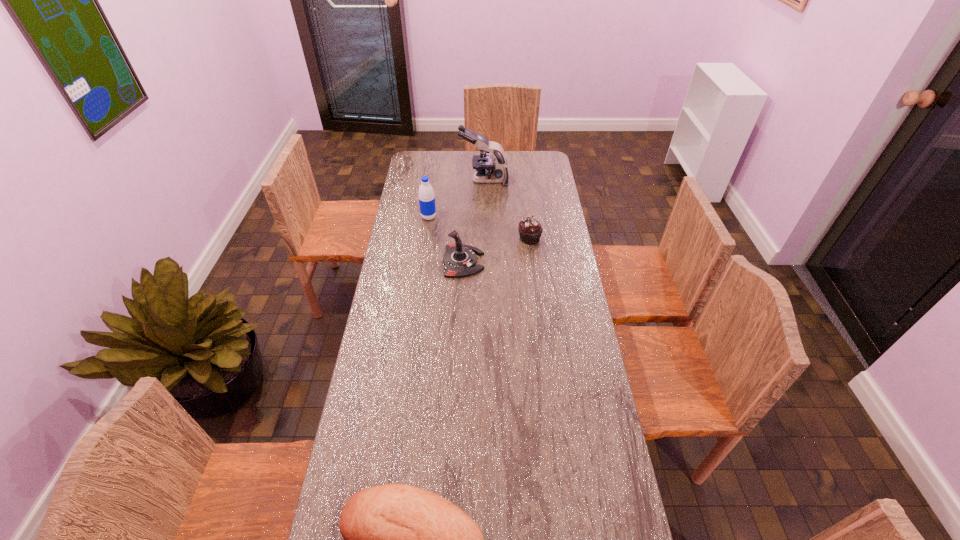
Find the location of a particular element. free spot between the microscope and the fourth shortest object is located at coordinates (456, 198).

Find the location of a particular element. The height and width of the screenshot is (540, 960). free space between the rightmost object and the tallest object is located at coordinates (507, 209).

You are a GUI agent. You are given a task and a screenshot of the screen. Output one action in this format:
    pyautogui.click(x=<x>, y=<y>)
    Task: Click on the free area in between the rightmost object and the fourth shortest object
    This screenshot has height=540, width=960.
    Given the screenshot: What is the action you would take?
    pyautogui.click(x=479, y=228)

I want to click on empty space that is in between the fourth shortest object and the microscope, so click(x=456, y=198).

The image size is (960, 540). Find the location of `free space that is in between the cupcake and the second tallest object`. free space that is in between the cupcake and the second tallest object is located at coordinates (479, 228).

Identify the location of unoccupied position between the joystick and the tallest object. The height and width of the screenshot is (540, 960). tap(473, 221).

Where is `vacant space that's between the third shortest object and the rightmost object`? The image size is (960, 540). vacant space that's between the third shortest object and the rightmost object is located at coordinates (496, 250).

Where is `unoccupied area between the cupcake and the tallest object`? Image resolution: width=960 pixels, height=540 pixels. unoccupied area between the cupcake and the tallest object is located at coordinates (507, 209).

Point out which object is positioned as the second nearest to the fourth nearest object. Please provide its 2D coordinates. Your answer should be formatted as a tuple, i.e. [(x, y)], where the tuple contains the x and y coordinates of a point satisfying the conditions above.

[(488, 169)]

Find the location of a particular element. Image resolution: width=960 pixels, height=540 pixels. object that is the second nearest to the fourth nearest object is located at coordinates (488, 169).